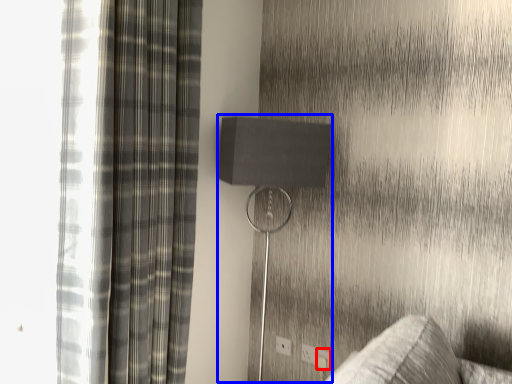
Question: Which of the following is the closest to the observer, electric outlet (highlighted by a red box) or table lamp (highlighted by a blue box)?

Choices:
 (A) electric outlet
 (B) table lamp

Answer: (B)